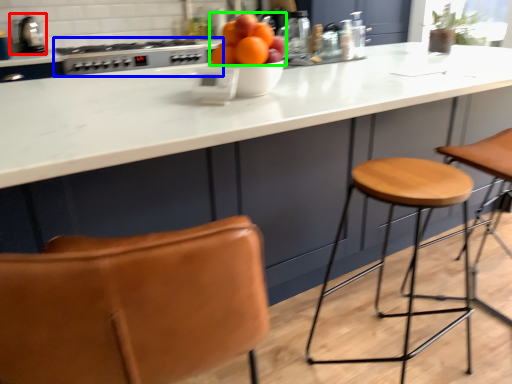
Question: Considering the real-world distances, which object is closest to appliance (highlighted by a red box)? gas stove (highlighted by a blue box) or orange (highlighted by a green box).

Choices:
 (A) gas stove
 (B) orange

Answer: (A)